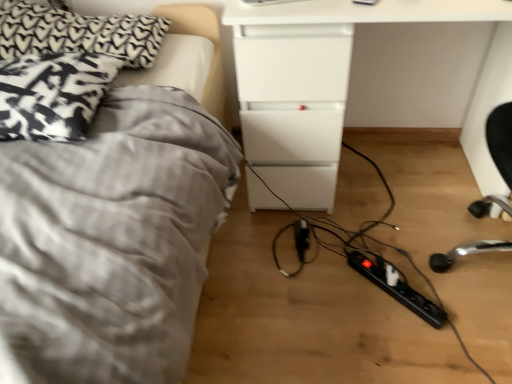
Question: Is black textured pillow at upper left, the second pillow positioned from the bottom, further to the viewer compared to black plastic extension cord at lower right, placed as the second extension cord when sorted from left to right?

Choices:
 (A) yes
 (B) no

Answer: (A)

Question: Does black textured pillow at upper left, the second pillow positioned from the bottom, have a larger size compared to black plastic extension cord at lower right, the first extension cord from the front?

Choices:
 (A) yes
 (B) no

Answer: (A)

Question: Is black textured pillow at upper left, the second pillow positioned from the bottom, positioned far away from black plastic extension cord at lower right, the first extension cord when ordered from bottom to top?

Choices:
 (A) yes
 (B) no

Answer: (A)

Question: Is black textured pillow at upper left, the second pillow positioned from the bottom, placed right next to black plastic extension cord at lower right, the first extension cord positioned from the right?

Choices:
 (A) no
 (B) yes

Answer: (A)

Question: Does black textured pillow at upper left, the second pillow positioned from the bottom, have a greater height compared to black plastic extension cord at lower right, the second extension cord when ordered from top to bottom?

Choices:
 (A) no
 (B) yes

Answer: (B)

Question: Is black plastic extension cord at center, which is the first extension cord in top-to-bottom order, taller or shorter than white glossy drawer at center?

Choices:
 (A) short
 (B) tall

Answer: (A)

Question: Considering their positions, is black plastic extension cord at center, which appears as the 2th extension cord when viewed from the right, located in front of or behind white glossy drawer at center?

Choices:
 (A) behind
 (B) front

Answer: (A)

Question: Is black plastic extension cord at center, which is the first extension cord in top-to-bottom order, wider or thinner than white glossy drawer at center?

Choices:
 (A) thin
 (B) wide

Answer: (A)

Question: Is black plastic extension cord at center, the 1th extension cord from the back, to the left or to the right of white glossy drawer at center in the image?

Choices:
 (A) right
 (B) left

Answer: (B)

Question: Is patterned fabric pillow at left, marked as the 1th pillow in a bottom-to-top arrangement, spatially inside white glossy drawer at center, or outside of it?

Choices:
 (A) inside
 (B) outside

Answer: (B)

Question: From a real-world perspective, is patterned fabric pillow at left, marked as the 2th pillow in a top-to-bottom arrangement, physically located above or below white glossy drawer at center?

Choices:
 (A) below
 (B) above

Answer: (B)

Question: Considering their positions, is patterned fabric pillow at left, marked as the 1th pillow in a bottom-to-top arrangement, located in front of or behind white glossy drawer at center?

Choices:
 (A) behind
 (B) front

Answer: (B)

Question: From the image's perspective, is patterned fabric pillow at left, marked as the 1th pillow in a bottom-to-top arrangement, positioned above or below white glossy drawer at center?

Choices:
 (A) below
 (B) above

Answer: (A)

Question: Considering the positions of patterned fabric pillow at left, marked as the 1th pillow in a bottom-to-top arrangement, and gray fabric bed at left in the image, is patterned fabric pillow at left, marked as the 1th pillow in a bottom-to-top arrangement, taller or shorter than gray fabric bed at left?

Choices:
 (A) tall
 (B) short

Answer: (B)

Question: From the image's perspective, is patterned fabric pillow at left, marked as the 1th pillow in a bottom-to-top arrangement, located above or below gray fabric bed at left?

Choices:
 (A) above
 (B) below

Answer: (A)